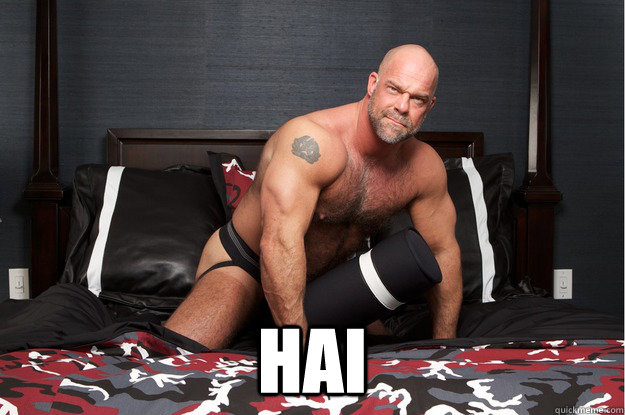
This screenshot has height=415, width=625. Identify the location of right white stripe on pillow. (479, 211).